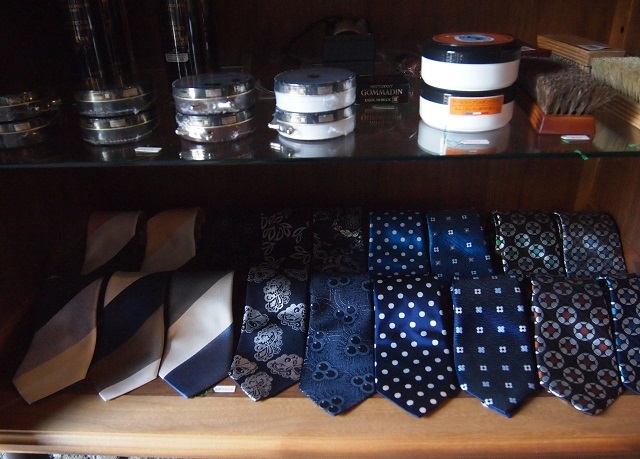
Find the location of `glass shelf`. glass shelf is located at coordinates (387, 151).